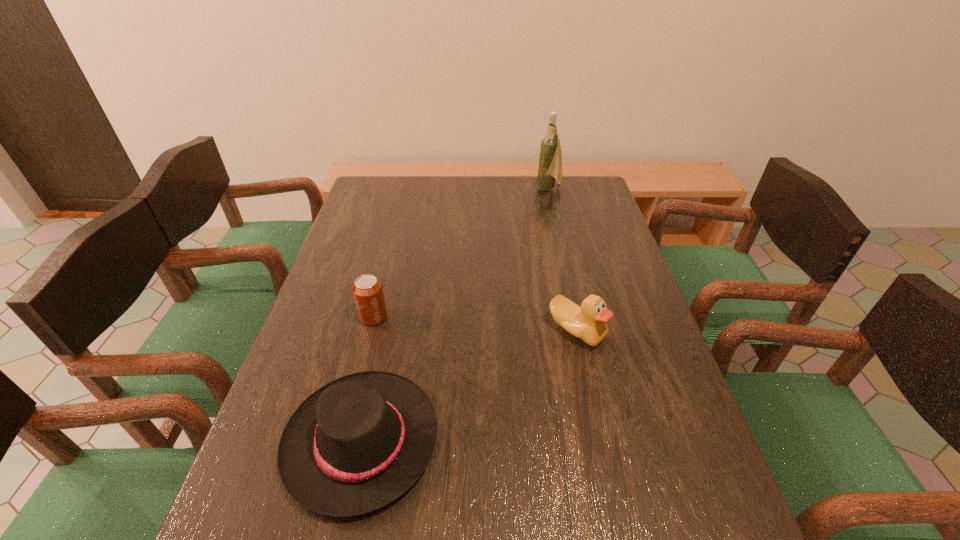
In the image, there is a desktop. In order to click on free region at the far left corner in this screenshot , I will do [382, 190].

Find the location of a particular element. blank space at the far right corner of the desktop is located at coordinates (571, 176).

Identify the location of vacant point located between the duck and the can. (475, 323).

The width and height of the screenshot is (960, 540). I want to click on unoccupied area between the duck and the nearest object, so click(468, 386).

Where is `free spot between the duck and the nearest object`? This screenshot has height=540, width=960. free spot between the duck and the nearest object is located at coordinates (468, 386).

This screenshot has height=540, width=960. In order to click on vacant point located between the nearest object and the farthest object in this screenshot , I will do `click(455, 315)`.

Locate an element on the screen. The image size is (960, 540). free space between the can and the tallest object is located at coordinates (461, 253).

This screenshot has height=540, width=960. I want to click on blank region between the nearest object and the duck, so click(468, 386).

Where is `vacant space that is in between the wine bottle and the can`? Image resolution: width=960 pixels, height=540 pixels. vacant space that is in between the wine bottle and the can is located at coordinates (461, 253).

The height and width of the screenshot is (540, 960). I want to click on free space between the can and the duck, so click(x=475, y=323).